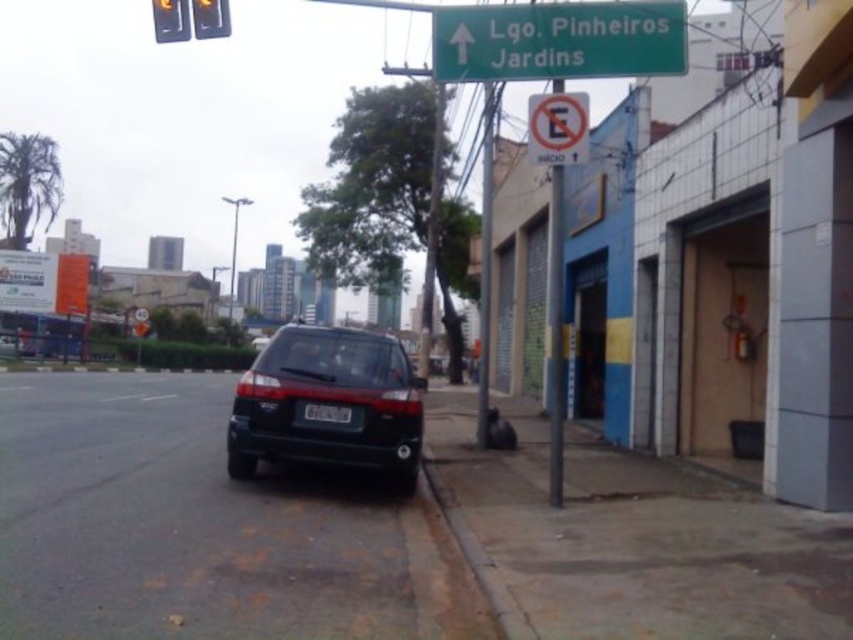
Looking at this image, you are a pedestrian standing on the sidewalk and looking ahead. Which object is taller between the red plastic sign at upper center and the metallic rectangular traffic light at upper center?

The metallic rectangular traffic light at upper center is taller than the red plastic sign at upper center.

You are a pedestrian standing on the sidewalk next to the shiny black suv at center and the metallic rectangular traffic light at upper center. You want to cross the street to the park on the other side. Considering the distance between the two objects, can you estimate how far you need to walk to reach the traffic light before crossing?

The distance between the shiny black suv at center and the metallic rectangular traffic light at upper center is 3.08 meters. Since you are standing next to the shiny black suv at center, you would need to walk approximately 3.08 meters to reach the traffic light before crossing.

You are standing at point (199, 19) and want to walk to point (383, 449). Is the path directly ahead of you?

Yes, the path from point (199, 19) to point (383, 449) is directly ahead because point (383, 449) is in front of point (199, 19).